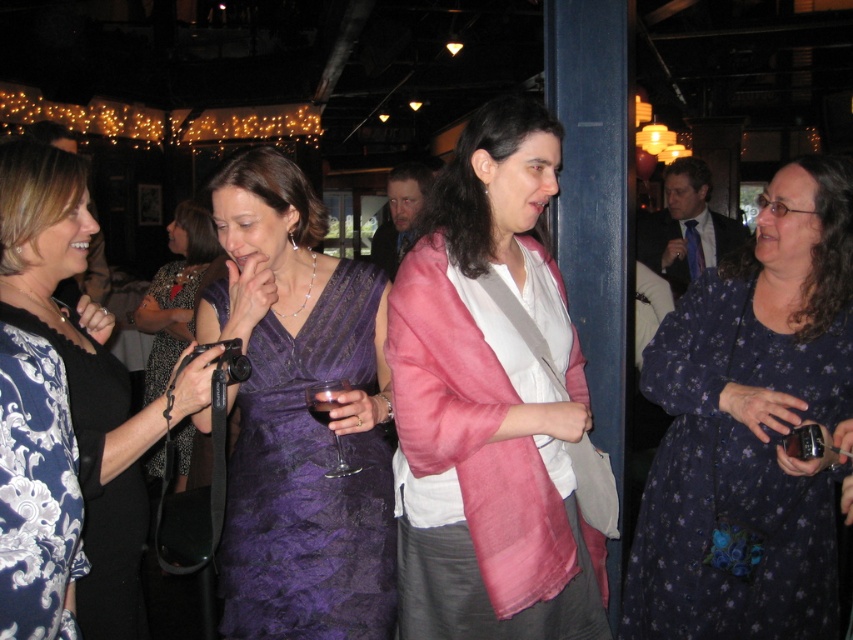
Question: Estimate the real-world distances between objects in this image. Which object is closer to the purple satin dress at center?

Choices:
 (A) transparent glass at center
 (B) dark red glass at center

Answer: (A)

Question: Does pink silk jacket at center appear on the right side of dark red glass at center?

Choices:
 (A) yes
 (B) no

Answer: (A)

Question: Based on their relative distances, which object is nearer to the transparent glass at center?

Choices:
 (A) purple satin dress at center
 (B) floral-patterned dress at center
 (C) dark blue floral dress at center
 (D) purple lace dress at center

Answer: (A)

Question: Does floral-patterned dress at center appear over dark red glass at center?

Choices:
 (A) yes
 (B) no

Answer: (A)

Question: Is pink silk jacket at center further to the viewer compared to blue floral dress at lower left?

Choices:
 (A) no
 (B) yes

Answer: (B)

Question: Which of the following is the closest to the observer?

Choices:
 (A) (309, 408)
 (B) (22, 147)
 (C) (343, 504)

Answer: (B)